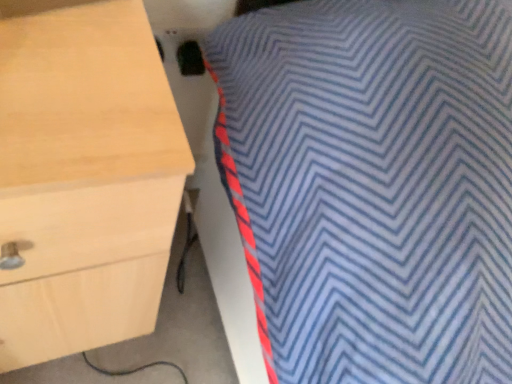
The image size is (512, 384). Describe the element at coordinates (84, 177) in the screenshot. I see `light wood chest of drawers at left` at that location.

In order to click on light wood chest of drawers at left in this screenshot , I will do `click(84, 177)`.

The height and width of the screenshot is (384, 512). Identify the location of light wood chest of drawers at left. (84, 177).